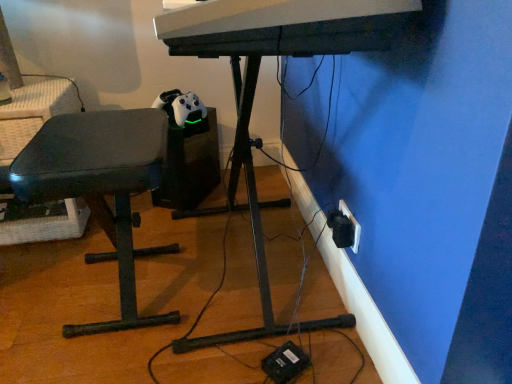
Question: Can you confirm if white plastic electric outlet at lower right is wider than matte black bench at left?

Choices:
 (A) yes
 (B) no

Answer: (B)

Question: Can you confirm if white plastic electric outlet at lower right is smaller than matte black bench at left?

Choices:
 (A) yes
 (B) no

Answer: (A)

Question: Can you confirm if white plastic electric outlet at lower right is positioned to the right of matte black bench at left?

Choices:
 (A) yes
 (B) no

Answer: (A)

Question: Can you confirm if white plastic electric outlet at lower right is bigger than matte black bench at left?

Choices:
 (A) yes
 (B) no

Answer: (B)

Question: Is white plastic electric outlet at lower right next to matte black bench at left?

Choices:
 (A) no
 (B) yes

Answer: (A)

Question: Is white plastic electric outlet at lower right inside the boundaries of matte black bench at left, or outside?

Choices:
 (A) outside
 (B) inside

Answer: (A)

Question: From a real-world perspective, is white plastic electric outlet at lower right physically located above or below matte black bench at left?

Choices:
 (A) above
 (B) below

Answer: (B)

Question: From the image's perspective, is white plastic electric outlet at lower right located above or below matte black bench at left?

Choices:
 (A) below
 (B) above

Answer: (A)

Question: Considering the relative positions of white plastic electric outlet at lower right and matte black bench at left in the image provided, is white plastic electric outlet at lower right to the left or to the right of matte black bench at left?

Choices:
 (A) left
 (B) right

Answer: (B)

Question: Relative to white plastic computer desk at center, is matte black bench at left in front or behind?

Choices:
 (A) behind
 (B) front

Answer: (A)

Question: In terms of height, does matte black bench at left look taller or shorter compared to white plastic computer desk at center?

Choices:
 (A) tall
 (B) short

Answer: (B)

Question: From the image's perspective, is matte black bench at left above or below white plastic computer desk at center?

Choices:
 (A) below
 (B) above

Answer: (A)

Question: Does point (167, 317) appear closer or farther from the camera than point (196, 347)?

Choices:
 (A) closer
 (B) farther

Answer: (B)

Question: From a real-world perspective, is white plastic computer desk at center above or below matte black bench at left?

Choices:
 (A) below
 (B) above

Answer: (B)

Question: Looking at the image, does white plastic computer desk at center seem bigger or smaller compared to matte black bench at left?

Choices:
 (A) small
 (B) big

Answer: (B)